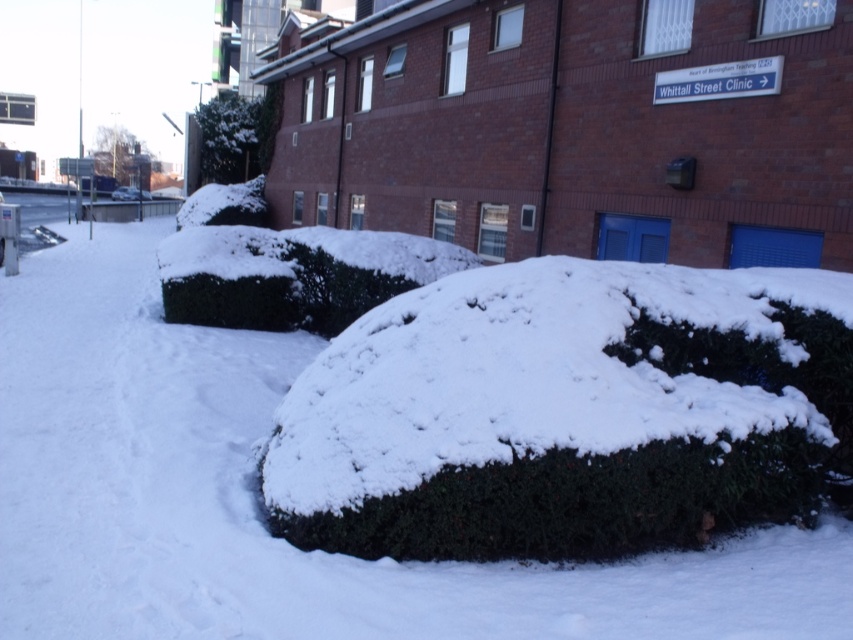
Question: Is green textured bush at center to the right of metallic silver car at center from the viewer's perspective?

Choices:
 (A) no
 (B) yes

Answer: (B)

Question: Can you confirm if green textured bush at center is positioned above metallic silver car at center?

Choices:
 (A) yes
 (B) no

Answer: (B)

Question: Can you confirm if green textured bush at center is positioned below metallic silver car at center?

Choices:
 (A) no
 (B) yes

Answer: (B)

Question: Which point is closer to the camera?

Choices:
 (A) metallic silver car at center
 (B) green textured bush at center

Answer: (B)